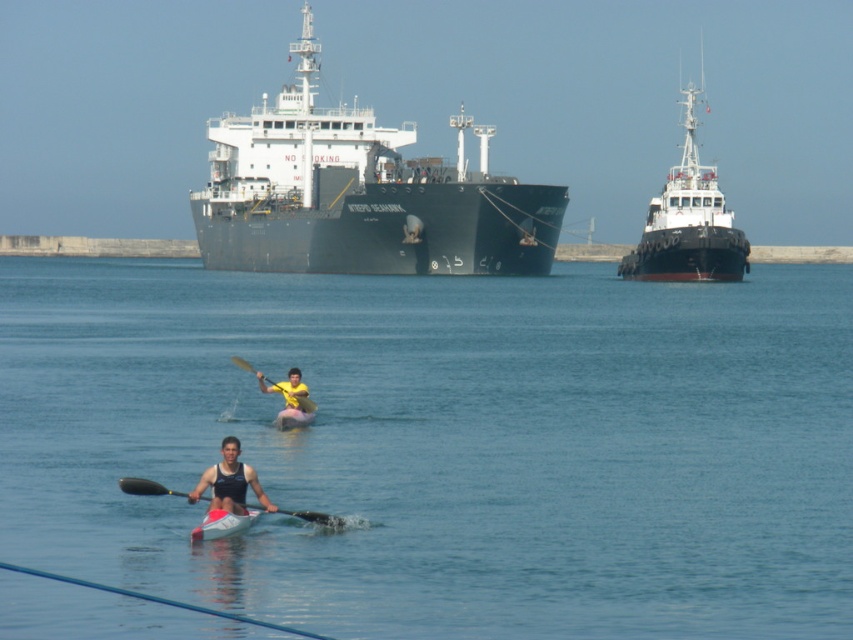
You are standing on the dock near the large cargo ship named INTREPID SEAHAWK and want to estimate how far the pink rubber kayak at center is from you. Based on the scene, can you determine the distance?

The pink rubber kayak at center is 48.43 meters away from the viewer.

You are standing at the point marked by the coordinates point (x=289, y=400). Looking around, you see two kayaks and a cargo ship. Which direction should you go to reach the nearest kayak?

The point (x=289, y=400) is exactly at the location of the yellow fabric kayak at center, so you are already at the nearest kayak.